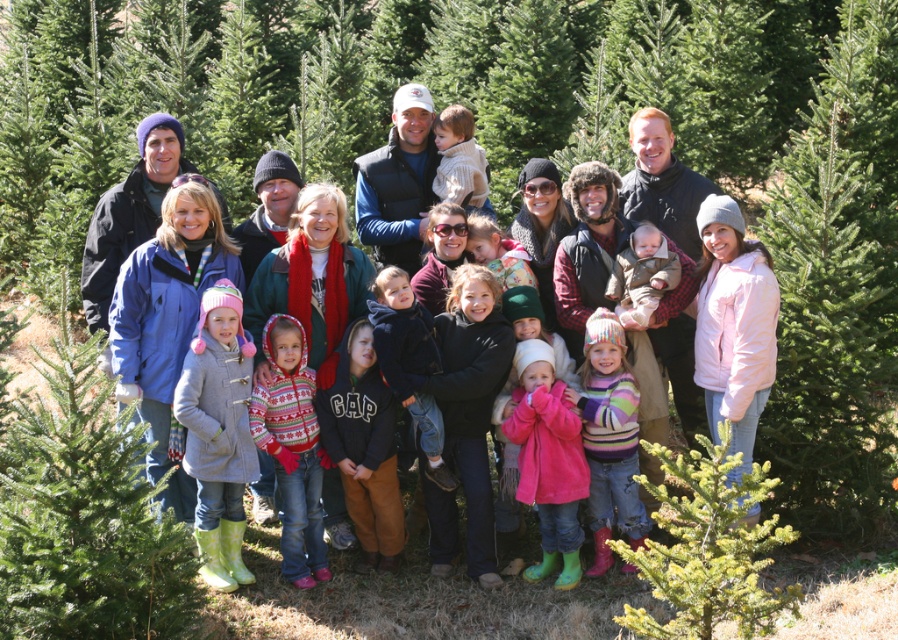
You are a photographer trying to capture a group photo of the family at the Christmas tree farm. You notice the striped sweater at center and the matte brown baby at center. Which object should you focus on first if you want to ensure both are in the frame without moving the camera?

The striped sweater at center is larger in size than the matte brown baby at center, so focusing on the larger striped sweater at center first will help ensure both are in the frame without needing to adjust the camera position.

You are a photographer trying to capture a group photo of the family at the Christmas tree farm. You need to ensure both the gray wool coat at center and the dark blue fleece jacket at center are visible in the frame. Based on their positions, which one should you position closer to the left side of the camera to include both in the photo?

The gray wool coat at center is to the left of the dark blue fleece jacket at center, so positioning the gray wool coat at center closer to the left side of the camera will ensure both are visible in the frame.

You are standing at the Christmas tree farm and see two points marked in the image. The first point is at coordinates point (249, 355) and the second is at point (437, 422). Which point is closer to you?

Point (249, 355) is in front of point (437, 422), so it is closer to you.